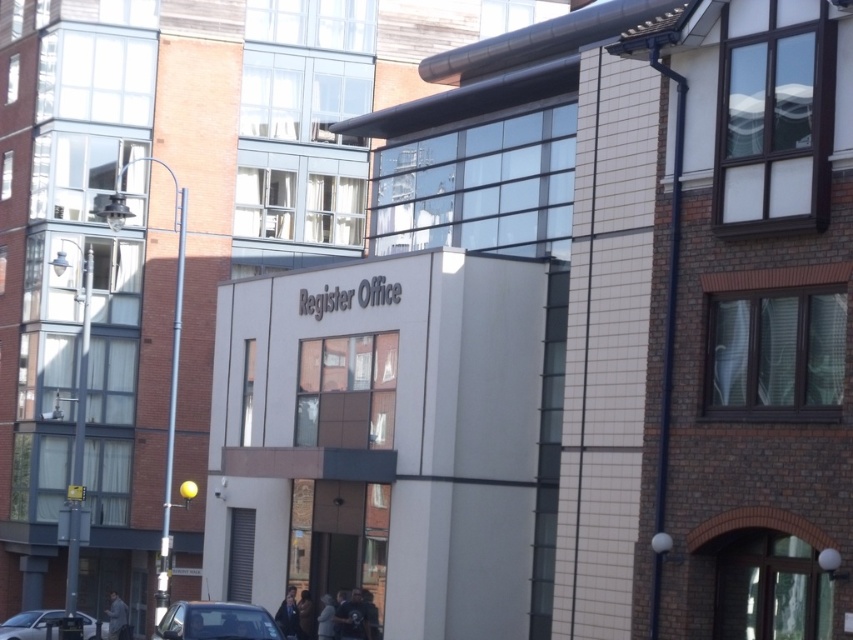
You are driving a car that requires a parking space of at least 15 meters. You see two cars, the metallic silver car at lower center and the silver metallic car at lower left. Can you park your car between them?

The metallic silver car at lower center and the silver metallic car at lower left are 18.23 meters apart, so yes, you can park your car between them since the distance is sufficient for your parking space requirement.

You are a delivery driver trying to park your metallic silver car at lower center between two cars. The space between the silver metallic car at lower left and another car is narrow. Can your car fit in that space?

The metallic silver car at lower center is thinner than the silver metallic car at lower left, so it should fit in the space between them since it has a smaller width.

Looking at this image, you are a delivery person trying to park a car that is 1.6 meters tall. You see two cars in the image, the metallic silver car at lower center and the silver metallic car at lower left. Which car can your delivery van park next to without hitting the overhead structure?

The metallic silver car at lower center is not as tall as the silver metallic car at lower left, so the delivery van should park next to the metallic silver car at lower center since it is shorter and less likely to hit the overhead structure.